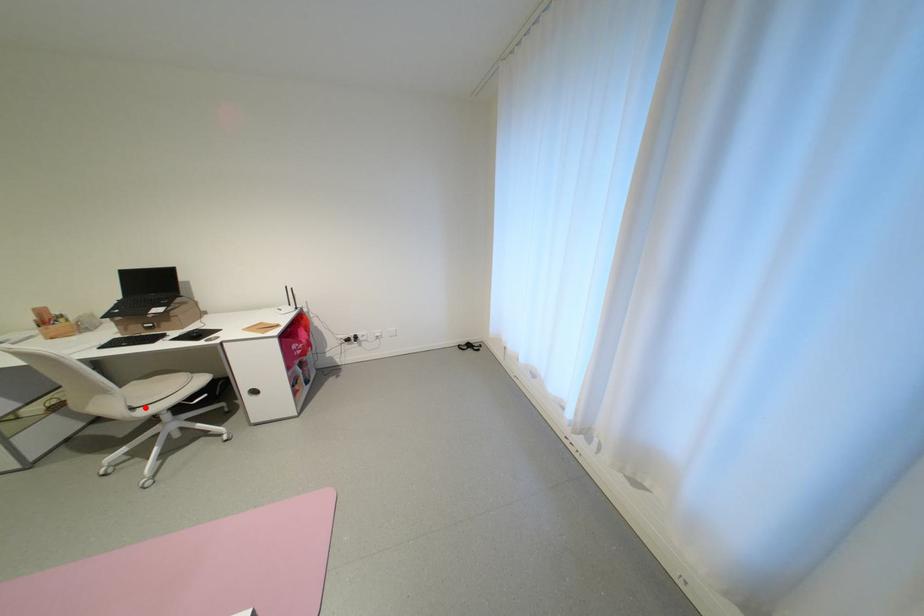
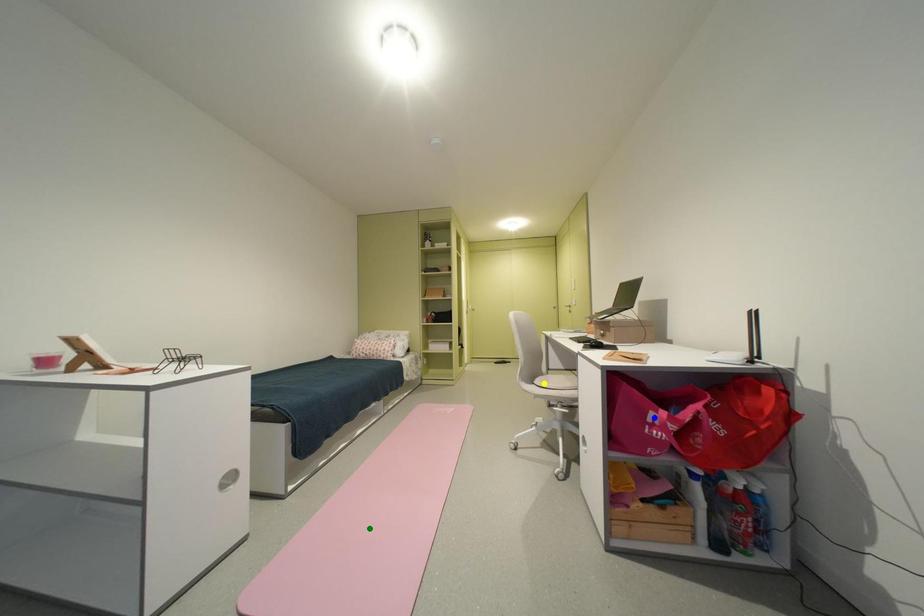
Question: I am providing you with two images of the same scene from different viewpoints. A red point is marked on the first image. You are given multiple points on the second image. Which mark in image 2 goes with the point in image 1?

Choices:
 (A) green point
 (B) yellow point
 (C) blue point

Answer: (B)